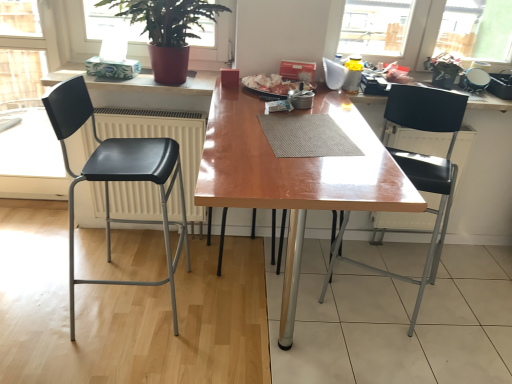
Question: Is the position of wooden table at center less distant than that of black matte chair at left, marked as the 2th chair in a right-to-left arrangement?

Choices:
 (A) no
 (B) yes

Answer: (B)

Question: From the image's perspective, is wooden table at center beneath black matte chair at left, marked as the 2th chair in a right-to-left arrangement?

Choices:
 (A) yes
 (B) no

Answer: (A)

Question: From a real-world perspective, is wooden table at center physically above black matte chair at left, marked as the 2th chair in a right-to-left arrangement?

Choices:
 (A) no
 (B) yes

Answer: (A)

Question: Is wooden table at center not close to black matte chair at left, marked as the 2th chair in a right-to-left arrangement?

Choices:
 (A) yes
 (B) no

Answer: (B)

Question: From the image's perspective, would you say wooden table at center is positioned over black matte chair at left, which is counted as the 1th chair, starting from the left?

Choices:
 (A) no
 (B) yes

Answer: (A)

Question: Visually, is black plastic chair at right, marked as the 1th chair in a right-to-left arrangement, positioned to the left or to the right of matte red pot at upper left?

Choices:
 (A) left
 (B) right

Answer: (B)

Question: Which is correct: black plastic chair at right, marked as the 1th chair in a right-to-left arrangement, is inside matte red pot at upper left, or outside of it?

Choices:
 (A) outside
 (B) inside

Answer: (A)

Question: Is point [443, 165] positioned closer to the camera than point [161, 64]?

Choices:
 (A) farther
 (B) closer

Answer: (B)

Question: In terms of height, does black plastic chair at right, which is the 2th chair in left-to-right order, look taller or shorter compared to matte red pot at upper left?

Choices:
 (A) tall
 (B) short

Answer: (A)

Question: In terms of height, does matte red pot at upper left look taller or shorter compared to black matte chair at left, marked as the 2th chair in a right-to-left arrangement?

Choices:
 (A) short
 (B) tall

Answer: (A)

Question: From a real-world perspective, is matte red pot at upper left positioned above or below black matte chair at left, marked as the 2th chair in a right-to-left arrangement?

Choices:
 (A) below
 (B) above

Answer: (B)

Question: Do you think matte red pot at upper left is within black matte chair at left, which is counted as the 1th chair, starting from the left, or outside of it?

Choices:
 (A) outside
 (B) inside

Answer: (A)

Question: Considering the positions of matte red pot at upper left and black matte chair at left, marked as the 2th chair in a right-to-left arrangement, in the image, is matte red pot at upper left bigger or smaller than black matte chair at left, marked as the 2th chair in a right-to-left arrangement,?

Choices:
 (A) big
 (B) small

Answer: (B)

Question: From the image's perspective, is matte red pot at upper left above or below wooden table at center?

Choices:
 (A) above
 (B) below

Answer: (A)

Question: In the image, is matte red pot at upper left positioned in front of or behind wooden table at center?

Choices:
 (A) front
 (B) behind

Answer: (B)